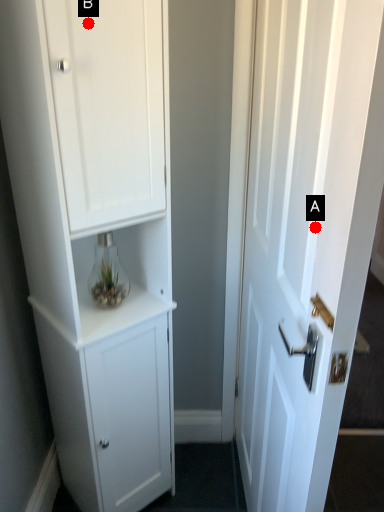
Question: Two points are circled on the image, labeled by A and B beside each circle. Among these points, which one is farthest from the camera?

Choices:
 (A) A is further
 (B) B is further

Answer: (B)